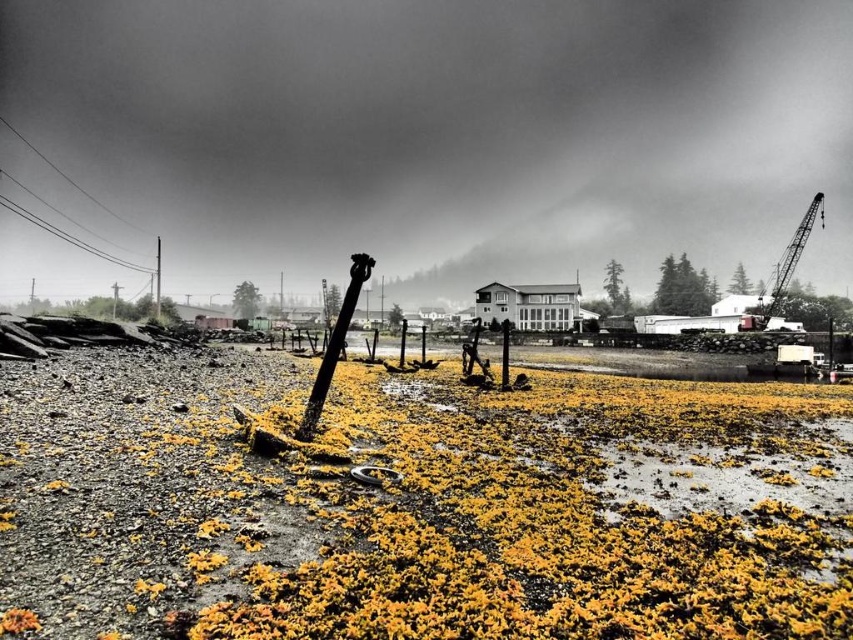
Question: Does yellow mossy mud at center have a greater width compared to metallic gray crane at upper right?

Choices:
 (A) yes
 (B) no

Answer: (B)

Question: Estimate the real-world distances between objects in this image. Which object is farther from the brushed metal telegraph pole at upper left?

Choices:
 (A) metallic gray crane at upper right
 (B) yellow mossy mud at center

Answer: (A)

Question: Can you confirm if yellow mossy mud at center is wider than metallic gray crane at upper right?

Choices:
 (A) no
 (B) yes

Answer: (A)

Question: Which point is closer to the camera taking this photo?

Choices:
 (A) (810, 209)
 (B) (726, 392)
 (C) (155, 298)

Answer: (B)

Question: Which point is closer to the camera?

Choices:
 (A) metallic gray crane at upper right
 (B) yellow mossy mud at center

Answer: (B)

Question: Is yellow mossy mud at center below metallic gray crane at upper right?

Choices:
 (A) yes
 (B) no

Answer: (A)